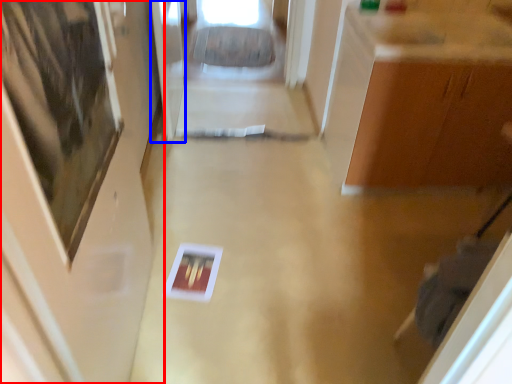
Question: Which object is further to the camera taking this photo, door (highlighted by a red box) or glass door (highlighted by a blue box)?

Choices:
 (A) door
 (B) glass door

Answer: (B)